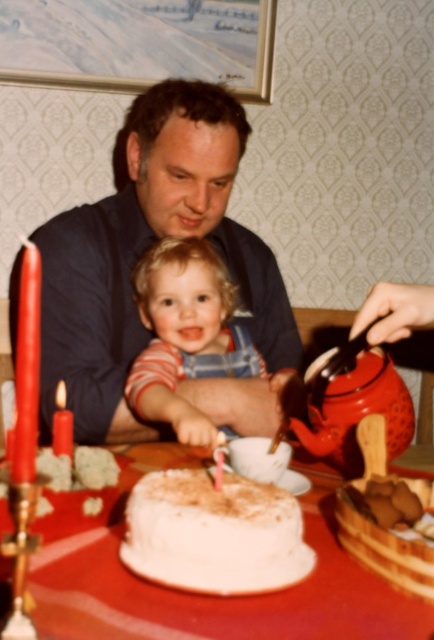
Question: Is white frosted cake at center smaller than red wax candle at left?

Choices:
 (A) yes
 (B) no

Answer: (A)

Question: Which point is farther from the camera taking this photo?

Choices:
 (A) (173, 323)
 (B) (16, 477)
 (C) (370, 628)
 (D) (174, 198)

Answer: (D)

Question: From the image, what is the correct spatial relationship of matte red teapot at right in relation to matte red candle at left?

Choices:
 (A) below
 (B) above

Answer: (B)

Question: Is matte red teapot at right closer to camera compared to matte red candle at left?

Choices:
 (A) no
 (B) yes

Answer: (A)

Question: Which point is closer to the camera?

Choices:
 (A) matte red teapot at right
 (B) white cake at center
 (C) white frosted cake at center

Answer: (B)

Question: Which is farther from the red wax candle at left?

Choices:
 (A) blonde hair baby at center
 (B) matte blue shirt at upper center
 (C) white cake at center

Answer: (B)